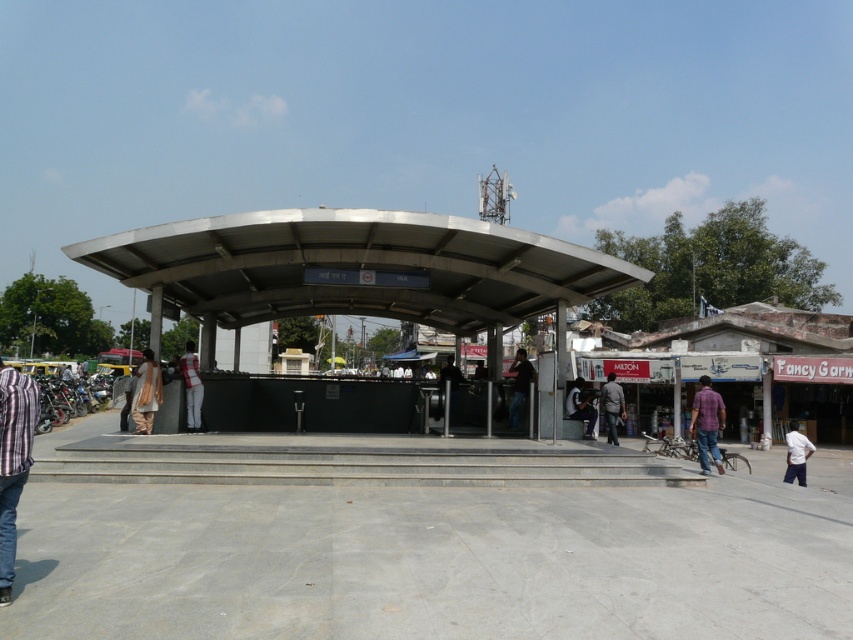
You are standing at the point labeled point (186, 419). You want to walk to the point labeled point (142, 433). Which direction should you face to walk straight towards it?

You should face north to walk straight towards point (142, 433) from point (186, 419).

You are standing in the plaza in front of the metallic curved roof structure. You notice two points marked on the ground at coordinates point (x=430, y=289) and point (x=790, y=461). If you want to reach the point that is closer to you, which coordinate should you go to?

You should go to point (x=790, y=461) because it is closer to you than point (x=430, y=289), which is further away.